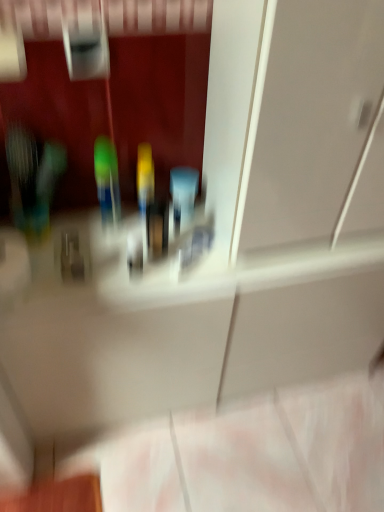
Question: In the image, is transparent glass door at upper center positioned in front of or behind green plastic toothbrush at center?

Choices:
 (A) behind
 (B) front

Answer: (B)

Question: Is transparent glass door at upper center inside or outside of green plastic toothbrush at center?

Choices:
 (A) inside
 (B) outside

Answer: (B)

Question: Visually, is transparent glass door at upper center positioned to the left or to the right of green plastic toothbrush at center?

Choices:
 (A) right
 (B) left

Answer: (A)

Question: Is point (102, 219) positioned closer to the camera than point (243, 228)?

Choices:
 (A) farther
 (B) closer

Answer: (A)

Question: Is green plastic toothbrush at center taller or shorter than transparent glass door at upper center?

Choices:
 (A) short
 (B) tall

Answer: (A)

Question: Relative to transparent glass door at upper center, is green plastic toothbrush at center in front or behind?

Choices:
 (A) front
 (B) behind

Answer: (B)

Question: Based on their sizes in the image, would you say green plastic toothbrush at center is bigger or smaller than transparent glass door at upper center?

Choices:
 (A) big
 (B) small

Answer: (B)